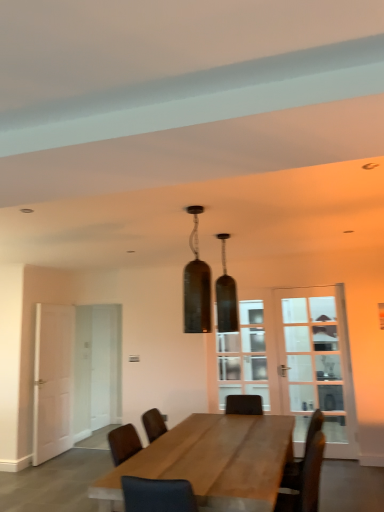
Where is `free space above wooden table at center (from a real-world perspective)`? free space above wooden table at center (from a real-world perspective) is located at coordinates (218, 454).